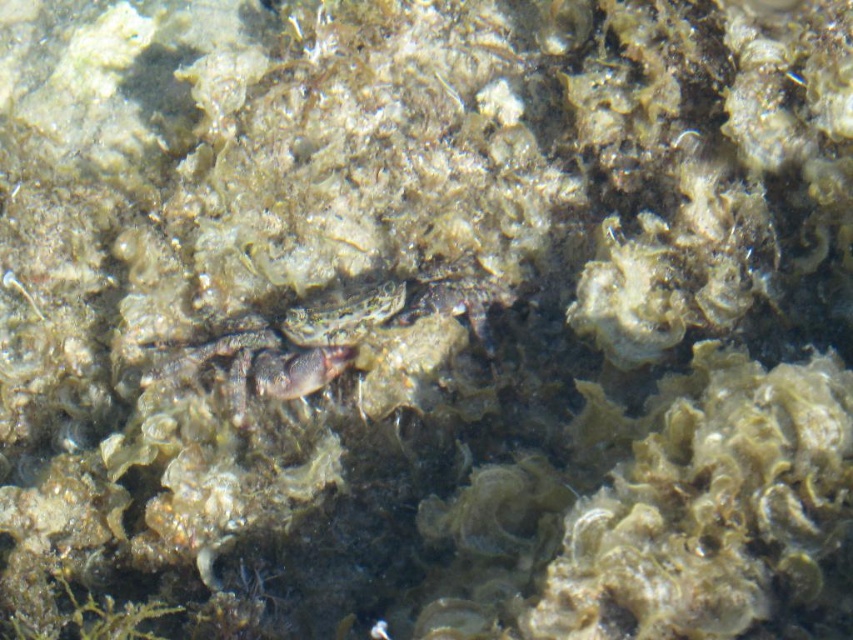
You are a marine biologist observing the underwater scene. You notice the translucent gray crab at center and the translucent greenish fish at center. Which of these two creatures has a greater width?

The translucent gray crab at center might be wider than the translucent greenish fish at center, so the crab likely has a greater width.

You are a marine biologist observing the underwater scene. You notice the translucent gray crab at center and the translucent greenish fish at center. Which of these two creatures has a greater height in this image?

The translucent gray crab at center is much taller than the translucent greenish fish at center.